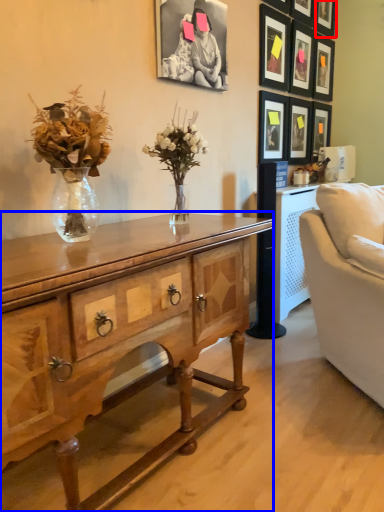
Question: Which of the following is the closest to the observer, picture frame (highlighted by a red box) or desk (highlighted by a blue box)?

Choices:
 (A) picture frame
 (B) desk

Answer: (B)